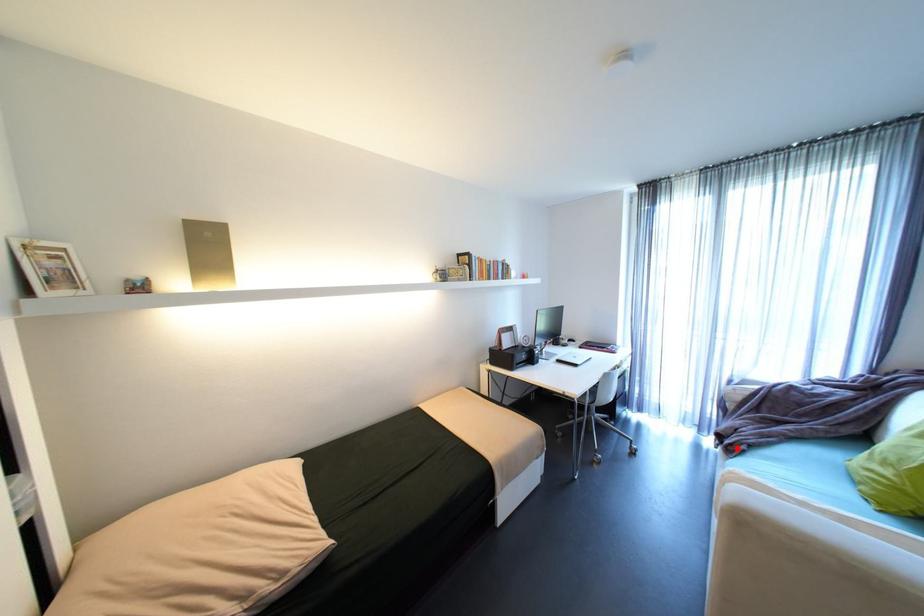
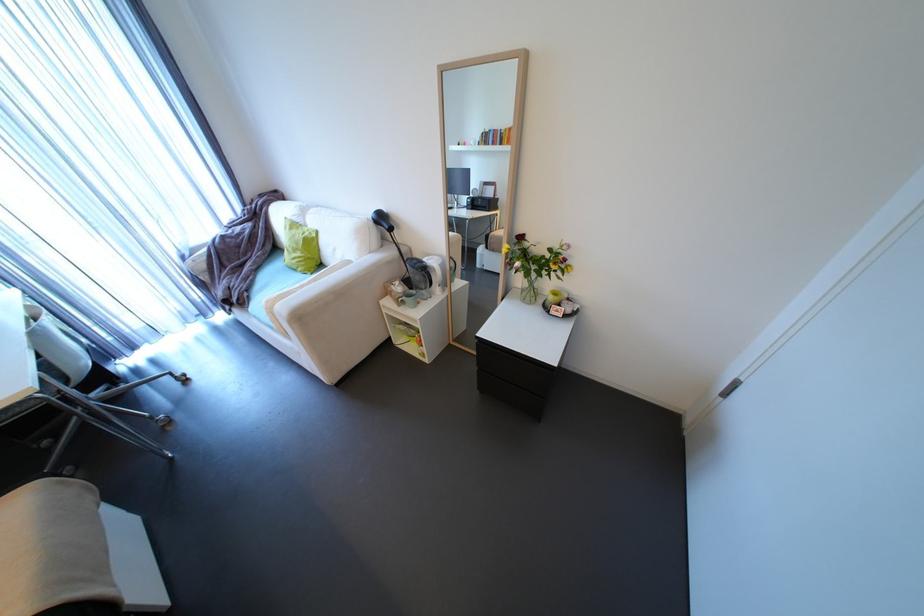
Where in the second image is the point corresponding to the highlighted location from the first image?

(248, 302)